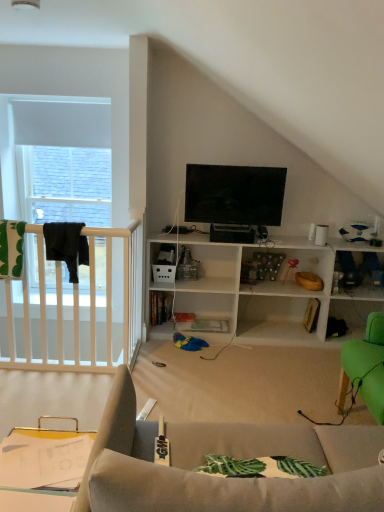
What is the approximate width of black fabric at left?

black fabric at left is 11.67 inches in width.

The image size is (384, 512). What are the coordinates of `flat screen tv at upper center` in the screenshot? It's located at (234, 199).

Which point is more distant from viewer, (52, 228) or (28, 470)?

The point (52, 228) is farther.

Is black fabric at left facing away from clear plastic tray at lower left?

No, black fabric at left is not facing the opposite direction of clear plastic tray at lower left.

Is black fabric at left outside of clear plastic tray at lower left?

Yes.

From a real-world perspective, between black fabric at left and clear plastic tray at lower left, who is vertically higher?

black fabric at left is physically above.

How distant is clear plastic tray at lower left from black fabric at left?

A distance of 4.58 feet exists between clear plastic tray at lower left and black fabric at left.

Is clear plastic tray at lower left in contact with black fabric at left?

There is a gap between clear plastic tray at lower left and black fabric at left.

Can you confirm if clear plastic tray at lower left is positioned to the right of black fabric at left?

Indeed, clear plastic tray at lower left is positioned on the right side of black fabric at left.

Which point is more forward, (6,443) or (71,262)?

The point (6,443) is more forward.

What's the angular difference between flat screen tv at upper center and clear plastic tray at lower left's facing directions?

The angle between the facing direction of flat screen tv at upper center and the facing direction of clear plastic tray at lower left is 85.7 degrees.

Based on the photo, between flat screen tv at upper center and clear plastic tray at lower left, which one appears on the right side from the viewer's perspective?

From the viewer's perspective, flat screen tv at upper center appears more on the right side.

From a real-world perspective, is flat screen tv at upper center on top of clear plastic tray at lower left?

Yes, from a real-world perspective, flat screen tv at upper center is over clear plastic tray at lower left

Could you tell me if flat screen tv at upper center is facing clear plastic tray at lower left?

No, flat screen tv at upper center does not turn towards clear plastic tray at lower left.

From the image's perspective, is clear plastic tray at lower left below flat screen tv at upper center?

Indeed, from the image's perspective, clear plastic tray at lower left is shown beneath flat screen tv at upper center.

Is clear plastic tray at lower left beside flat screen tv at upper center?

clear plastic tray at lower left and flat screen tv at upper center are not in contact.

Find the location of a particular element. Image resolution: width=384 pixels, height=512 pixels. television above the clear plastic tray at lower left (from a real-world perspective) is located at coordinates (234, 199).

Which object is further away from the camera taking this photo, clear plastic tray at lower left or flat screen tv at upper center?

flat screen tv at upper center is further away from the camera.

Does flat screen tv at upper center have a greater height compared to black fabric at left?

Indeed, flat screen tv at upper center has a greater height compared to black fabric at left.

Considering the positions of objects flat screen tv at upper center and black fabric at left in the image provided, who is more to the right, flat screen tv at upper center or black fabric at left?

From the viewer's perspective, flat screen tv at upper center appears more on the right side.

From a real-world perspective, is flat screen tv at upper center positioned above or below black fabric at left?

flat screen tv at upper center is situated higher than black fabric at left in the real world.

Is flat screen tv at upper center positioned in front of black fabric at left?

No, it is not.

Considering the positions of point (57, 251) and point (260, 204), is point (57, 251) closer or farther from the camera than point (260, 204)?

Clearly, point (57, 251) is closer to the camera than point (260, 204).

Could you tell me if black fabric at left is turned towards flat screen tv at upper center?

No, black fabric at left is not oriented towards flat screen tv at upper center.

Can you see black fabric at left touching flat screen tv at upper center?

No, black fabric at left is not touching flat screen tv at upper center.

Where is `television lying behind the black fabric at left`? This screenshot has width=384, height=512. television lying behind the black fabric at left is located at coordinates (234, 199).

Locate an element on the screen. This screenshot has height=512, width=384. table located below the black fabric at left (from the image's perspective) is located at coordinates (42, 468).

This screenshot has width=384, height=512. What are the coordinates of `clothesline behind the clear plastic tray at lower left` in the screenshot? It's located at (66, 246).

Looking at the image, which one is located further to black fabric at left, flat screen tv at upper center or clear plastic tray at lower left?

clear plastic tray at lower left.

From the image, which object appears to be nearer to black fabric at left, clear plastic tray at lower left or flat screen tv at upper center?

Among the two, flat screen tv at upper center is located nearer to black fabric at left.

Consider the image. Which object lies further to the anchor point flat screen tv at upper center, black fabric at left or clear plastic tray at lower left?

The object further to flat screen tv at upper center is clear plastic tray at lower left.

Considering their positions, is clear plastic tray at lower left positioned further to flat screen tv at upper center than black fabric at left?

clear plastic tray at lower left lies further to flat screen tv at upper center than the other object.

Estimate the real-world distances between objects in this image. Which object is further from clear plastic tray at lower left, black fabric at left or flat screen tv at upper center?

The object further to clear plastic tray at lower left is flat screen tv at upper center.

Looking at the image, which one is located closer to clear plastic tray at lower left, flat screen tv at upper center or black fabric at left?

black fabric at left is closer to clear plastic tray at lower left.

Where is `clothesline between clear plastic tray at lower left and flat screen tv at upper center along the z-axis`? clothesline between clear plastic tray at lower left and flat screen tv at upper center along the z-axis is located at coordinates (66, 246).